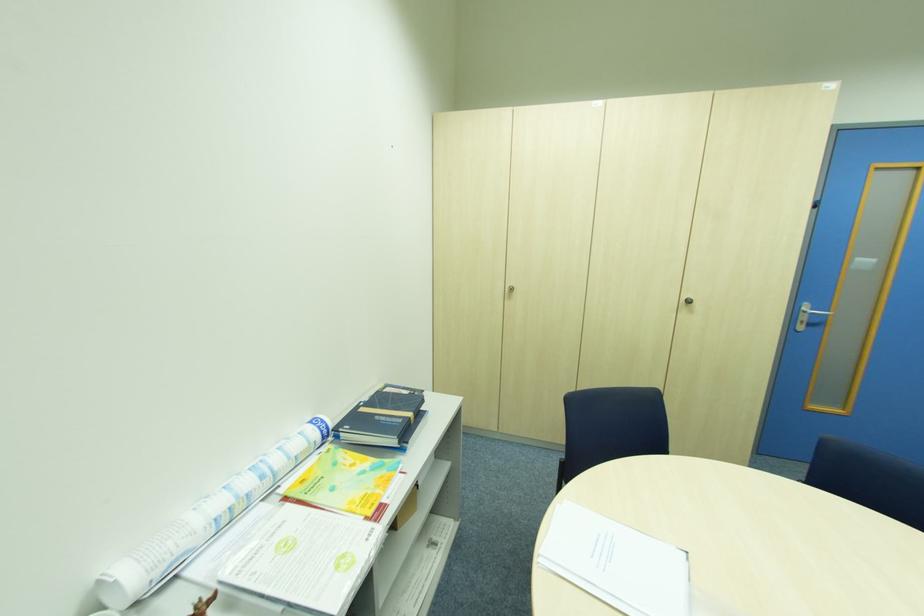
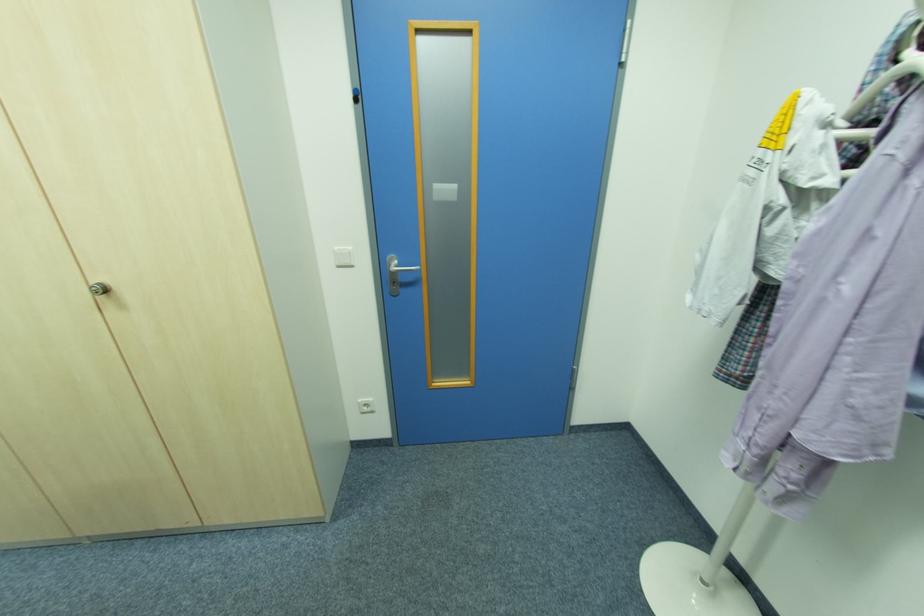
Question: What movement of the cameraman would produce the second image?

Choices:
 (A) Left
 (B) Right
 (C) Forward
 (D) Backward

Answer: (B)